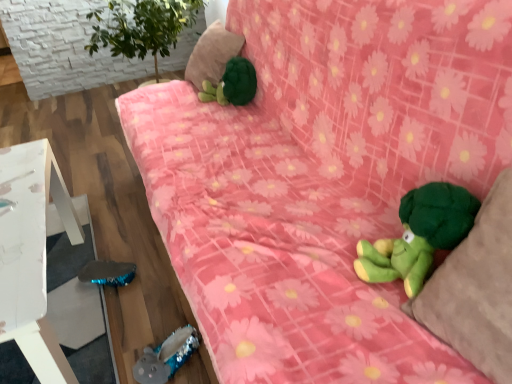
Measure the distance between point (475,329) and camera.

Point (475,329) is 27.13 inches from camera.

This screenshot has height=384, width=512. What do you see at coordinates (232, 84) in the screenshot?
I see `green plush turtle at upper center, the third toy positioned from the front` at bounding box center [232, 84].

I want to click on green plush pillow at right, acting as the second pillow starting from the top, so click(x=476, y=289).

From a real-world perspective, is green plush toy at lower right, positioned as the third toy in back-to-front order, above or below green plush at upper center, placed as the 1th pillow when sorted from left to right?

green plush toy at lower right, positioned as the third toy in back-to-front order, is situated lower than green plush at upper center, placed as the 1th pillow when sorted from left to right, in the real world.

The height and width of the screenshot is (384, 512). I want to click on the 2nd toy below the green plush at upper center, placed as the 1th pillow when sorted from left to right (from the image's perspective), so click(x=419, y=235).

Is green plush toy at lower right, the second toy viewed from the top, inside the boundaries of green plush at upper center, placed as the 1th pillow when sorted from left to right, or outside?

green plush toy at lower right, the second toy viewed from the top, is located beyond the bounds of green plush at upper center, placed as the 1th pillow when sorted from left to right.

Between green plush toy at lower right, the 2th toy ordered from the bottom, and green plush at upper center, the 2th pillow positioned from the bottom, which one has smaller width?

With smaller width is green plush toy at lower right, the 2th toy ordered from the bottom.

Could you tell me if green plush at upper center, which ranks as the 2th pillow in right-to-left order, is facing shiny blue plush toy at lower left, which is the 1th toy from bottom to top?

No, green plush at upper center, which ranks as the 2th pillow in right-to-left order, is not aimed at shiny blue plush toy at lower left, which is the 1th toy from bottom to top.

How distant is green plush at upper center, which is the first pillow in top-to-bottom order, from shiny blue plush toy at lower left, the first toy when ordered from left to right?

A distance of 1.20 meters exists between green plush at upper center, which is the first pillow in top-to-bottom order, and shiny blue plush toy at lower left, the first toy when ordered from left to right.

This screenshot has width=512, height=384. In order to click on the 3rd toy below the green plush at upper center, placed as the 1th pillow when sorted from left to right (from the image's perspective) in this screenshot , I will do `click(166, 356)`.

Which of these two, shiny blue plush toy at lower left, the 2th toy when ordered from front to back, or green plush turtle at upper center, the third toy ordered from the bottom, stands shorter?

shiny blue plush toy at lower left, the 2th toy when ordered from front to back.

In the scene shown: Who is bigger, shiny blue plush toy at lower left, the first toy when ordered from left to right, or green plush turtle at upper center, the third toy ordered from the bottom?

green plush turtle at upper center, the third toy ordered from the bottom, is bigger.

Is shiny blue plush toy at lower left, which is the third toy in right-to-left order, aimed at green plush turtle at upper center, the 1th toy when ordered from back to front?

No, shiny blue plush toy at lower left, which is the third toy in right-to-left order, is not oriented towards green plush turtle at upper center, the 1th toy when ordered from back to front.

From the image's perspective, between shiny blue plush toy at lower left, placed as the 3th toy when sorted from top to bottom, and green plush turtle at upper center, the 1th toy when ordered from top to bottom, who is located below?

From the image's view, shiny blue plush toy at lower left, placed as the 3th toy when sorted from top to bottom, is below.

Between point (213, 36) and point (398, 274), which one is positioned in front?

The point (398, 274) is closer.

Considering the sizes of objects green plush at upper center, the 2th pillow positioned from the bottom, and green plush toy at lower right, which appears as the first toy when viewed from the front, in the image provided, who is thinner, green plush at upper center, the 2th pillow positioned from the bottom, or green plush toy at lower right, which appears as the first toy when viewed from the front,?

With smaller width is green plush toy at lower right, which appears as the first toy when viewed from the front.

Between green plush at upper center, the 2th pillow positioned from the bottom, and green plush toy at lower right, positioned as the first toy in right-to-left order, which one appears on the right side from the viewer's perspective?

green plush toy at lower right, positioned as the first toy in right-to-left order.

Is green plush at upper center, placed as the 1th pillow when sorted from left to right, placed right next to green plush toy at lower right, positioned as the first toy in right-to-left order?

No, green plush at upper center, placed as the 1th pillow when sorted from left to right, is not in contact with green plush toy at lower right, positioned as the first toy in right-to-left order.

Is point (13, 217) closer to camera compared to point (246, 72)?

Yes, point (13, 217) is in front of point (246, 72).

Consider the image. Is white painted wood table at lower left at the right side of green plush turtle at upper center, the 1th toy when ordered from top to bottom?

No.

From the image's perspective, would you say white painted wood table at lower left is shown under green plush turtle at upper center, the third toy ordered from the bottom?

Yes, from the image's perspective, white painted wood table at lower left is beneath green plush turtle at upper center, the third toy ordered from the bottom.

Could you tell me if white painted wood table at lower left is facing green plush turtle at upper center, the third toy ordered from the bottom?

No, white painted wood table at lower left does not turn towards green plush turtle at upper center, the third toy ordered from the bottom.

Which of these two, green plush turtle at upper center, the 1th toy when ordered from top to bottom, or green plush pillow at right, the first pillow positioned from the right, is wider?

green plush pillow at right, the first pillow positioned from the right, is wider.

Is green plush turtle at upper center, the 1th toy when ordered from back to front, beside green plush pillow at right, which is the first pillow in front-to-back order?

There is a gap between green plush turtle at upper center, the 1th toy when ordered from back to front, and green plush pillow at right, which is the first pillow in front-to-back order.

From a real-world perspective, is green plush turtle at upper center, which appears as the 2th toy when viewed from the right, physically above green plush pillow at right, acting as the second pillow starting from the top?

No, from a real-world perspective, green plush turtle at upper center, which appears as the 2th toy when viewed from the right, is not above green plush pillow at right, acting as the second pillow starting from the top.

How many degrees apart are the facing directions of green plush turtle at upper center, the third toy positioned from the front, and green plush pillow at right, placed as the 2th pillow when sorted from back to front?

The angular difference between green plush turtle at upper center, the third toy positioned from the front, and green plush pillow at right, placed as the 2th pillow when sorted from back to front, is 3.21e-05 degrees.

Based on their positions, is green plush toy at lower right, which appears as the first toy when viewed from the front, located to the left or right of shiny blue plush toy at lower left, placed as the 3th toy when sorted from top to bottom?

Clearly, green plush toy at lower right, which appears as the first toy when viewed from the front, is on the right of shiny blue plush toy at lower left, placed as the 3th toy when sorted from top to bottom, in the image.

In the image, is green plush toy at lower right, positioned as the third toy in back-to-front order, positioned in front of or behind shiny blue plush toy at lower left, the 2th toy when ordered from front to back?

green plush toy at lower right, positioned as the third toy in back-to-front order, is positioned closer to the viewer than shiny blue plush toy at lower left, the 2th toy when ordered from front to back.

Considering the relative sizes of green plush toy at lower right, which appears as the first toy when viewed from the front, and shiny blue plush toy at lower left, which is the 1th toy from bottom to top, in the image provided, is green plush toy at lower right, which appears as the first toy when viewed from the front, wider than shiny blue plush toy at lower left, which is the 1th toy from bottom to top,?

Yes, green plush toy at lower right, which appears as the first toy when viewed from the front, is wider than shiny blue plush toy at lower left, which is the 1th toy from bottom to top.

From a real-world perspective, relative to shiny blue plush toy at lower left, which is the third toy in right-to-left order, is green plush toy at lower right, the second toy viewed from the top, vertically above or below?

green plush toy at lower right, the second toy viewed from the top, is situated higher than shiny blue plush toy at lower left, which is the third toy in right-to-left order, in the real world.

The image size is (512, 384). What are the coordinates of `the 2nd toy to the right of the green plush at upper center, acting as the second pillow starting from the front, counting from the anchor's position` in the screenshot? It's located at (419, 235).

The width and height of the screenshot is (512, 384). Find the location of `the 3rd toy positioned below the green plush at upper center, acting as the second pillow starting from the front (from the image's perspective)`. the 3rd toy positioned below the green plush at upper center, acting as the second pillow starting from the front (from the image's perspective) is located at coordinates (166, 356).

Based on their spatial positions, is white painted wood table at lower left or green plush toy at lower right, positioned as the third toy in back-to-front order, closer to green plush pillow at right, acting as the second pillow starting from the top?

Based on the image, green plush toy at lower right, positioned as the third toy in back-to-front order, appears to be nearer to green plush pillow at right, acting as the second pillow starting from the top.

Which object lies nearer to the anchor point green plush pillow at right, which is the first pillow in front-to-back order, green plush turtle at upper center, the third toy ordered from the bottom, or white painted wood table at lower left?

The object closer to green plush pillow at right, which is the first pillow in front-to-back order, is white painted wood table at lower left.

Which object lies further to the anchor point green plush turtle at upper center, the third toy ordered from the bottom, white painted wood table at lower left or shiny blue plush toy at lower left, which appears as the 2th toy when viewed from the back?

shiny blue plush toy at lower left, which appears as the 2th toy when viewed from the back, lies further to green plush turtle at upper center, the third toy ordered from the bottom, than the other object.

Considering their positions, is green plush pillow at right, the first pillow positioned from the right, positioned closer to green plush turtle at upper center, positioned as the 2th toy in left-to-right order, than white painted wood table at lower left?

white painted wood table at lower left is closer to green plush turtle at upper center, positioned as the 2th toy in left-to-right order.

Which object lies nearer to the anchor point green plush toy at lower right, which appears as the first toy when viewed from the front, green plush pillow at right, acting as the 2th pillow starting from the left, or white painted wood table at lower left?

Among the two, green plush pillow at right, acting as the 2th pillow starting from the left, is located nearer to green plush toy at lower right, which appears as the first toy when viewed from the front.

Looking at the image, which one is located further to white painted wood table at lower left, green plush at upper center, acting as the second pillow starting from the front, or green plush pillow at right, placed as the 2th pillow when sorted from back to front?

green plush pillow at right, placed as the 2th pillow when sorted from back to front, is positioned further to the anchor white painted wood table at lower left.

When comparing their distances from shiny blue plush toy at lower left, which is the 1th toy from bottom to top, does green plush turtle at upper center, the third toy ordered from the bottom, or green plush toy at lower right, the second toy viewed from the top, seem closer?

The object closer to shiny blue plush toy at lower left, which is the 1th toy from bottom to top, is green plush toy at lower right, the second toy viewed from the top.

Based on their spatial positions, is shiny blue plush toy at lower left, placed as the 3th toy when sorted from top to bottom, or white painted wood table at lower left further from green plush at upper center, which ranks as the 2th pillow in right-to-left order?

Based on the image, shiny blue plush toy at lower left, placed as the 3th toy when sorted from top to bottom, appears to be further to green plush at upper center, which ranks as the 2th pillow in right-to-left order.

The image size is (512, 384). Identify the location of furniture between green plush at upper center, which ranks as the 2th pillow in right-to-left order, and shiny blue plush toy at lower left, which appears as the 2th toy when viewed from the back, in the vertical direction. (32, 254).

The height and width of the screenshot is (384, 512). Identify the location of furniture between green plush pillow at right, acting as the second pillow starting from the top, and green plush at upper center, placed as the 1th pillow when sorted from left to right, along the z-axis. (32, 254).

Locate an element on the screen. The width and height of the screenshot is (512, 384). furniture between green plush toy at lower right, which appears as the first toy when viewed from the front, and green plush at upper center, the first pillow when ordered from back to front, from front to back is located at coordinates (32, 254).

Locate an element on the screen. The image size is (512, 384). furniture between green plush pillow at right, which is the first pillow in front-to-back order, and green plush turtle at upper center, the third toy ordered from the bottom, in the front-back direction is located at coordinates (32, 254).